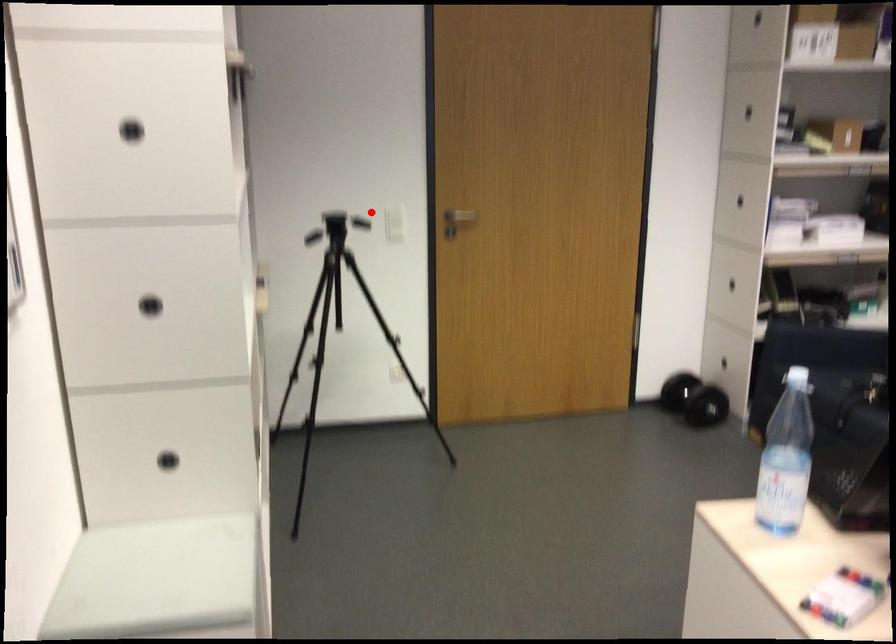
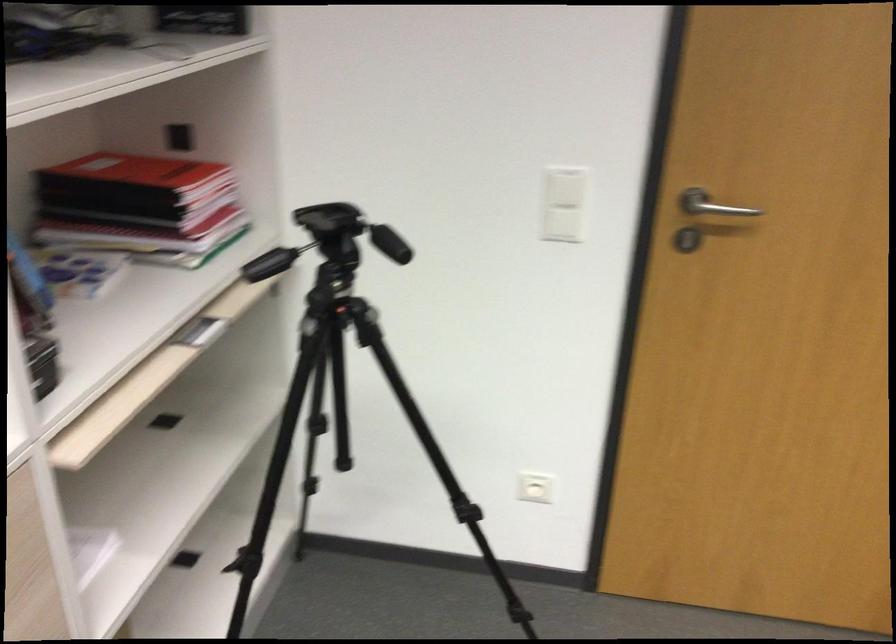
Find the pixel in the second image that matches the highlighted location in the first image.

(565, 187)